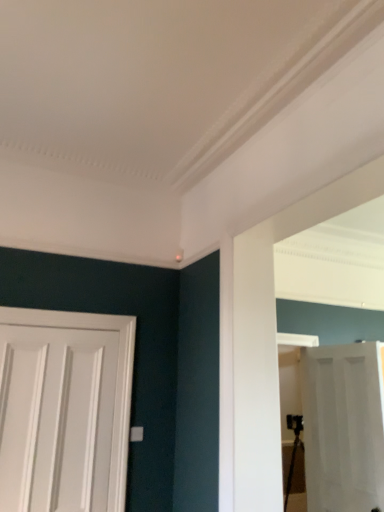
Question: In the image, is white matte door at right, placed as the second door when sorted from left to right, on the left side or the right side of white matte door at left, marked as the 2th door in a back-to-front arrangement?

Choices:
 (A) left
 (B) right

Answer: (B)

Question: Is point (380, 480) positioned closer to the camera than point (56, 361)?

Choices:
 (A) closer
 (B) farther

Answer: (B)

Question: Looking at their shapes, would you say white matte door at right, which is counted as the 1th door, starting from the back, is wider or thinner than white matte door at left, placed as the 1th door when sorted from front to back?

Choices:
 (A) wide
 (B) thin

Answer: (A)

Question: Is white matte door at left, arranged as the first door when viewed from the left, wider or thinner than white matte door at right, placed as the second door when sorted from left to right?

Choices:
 (A) wide
 (B) thin

Answer: (B)

Question: Is white matte door at left, placed as the 1th door when sorted from front to back, in front of or behind white matte door at right, which ranks as the 2th door in front-to-back order, in the image?

Choices:
 (A) behind
 (B) front

Answer: (B)

Question: From a real-world perspective, relative to white matte door at right, which ranks as the 2th door in front-to-back order, is white matte door at left, placed as the 1th door when sorted from front to back, vertically above or below?

Choices:
 (A) below
 (B) above

Answer: (B)

Question: From their relative heights in the image, would you say white matte door at left, the 2th door from the right, is taller or shorter than white matte door at right, placed as the second door when sorted from left to right?

Choices:
 (A) tall
 (B) short

Answer: (B)